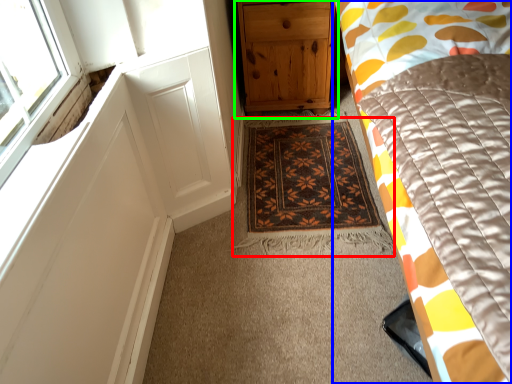
Question: Estimate the real-world distances between objects in this image. Which object is closer to mat (highlighted by a red box), bed (highlighted by a blue box) or chest of drawers (highlighted by a green box)?

Choices:
 (A) bed
 (B) chest of drawers

Answer: (B)